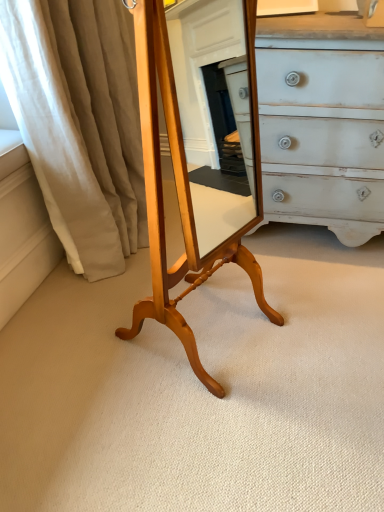
The height and width of the screenshot is (512, 384). I want to click on light brown wood table at center, so click(177, 196).

This screenshot has width=384, height=512. What do you see at coordinates (177, 196) in the screenshot? I see `light brown wood table at center` at bounding box center [177, 196].

Where is `beige fabric curtain at left`? The image size is (384, 512). beige fabric curtain at left is located at coordinates (80, 123).

Measure the distance between beige fabric curtain at left and camera.

beige fabric curtain at left and camera are 3.66 feet apart from each other.

The height and width of the screenshot is (512, 384). Describe the element at coordinates (80, 123) in the screenshot. I see `beige fabric curtain at left` at that location.

Image resolution: width=384 pixels, height=512 pixels. I want to click on light brown wood table at center, so click(177, 196).

Considering the positions of objects beige fabric curtain at left and light brown wood table at center in the image provided, who is more to the left, beige fabric curtain at left or light brown wood table at center?

Positioned to the left is beige fabric curtain at left.

Looking at this image, considering the positions of objects beige fabric curtain at left and light brown wood table at center in the image provided, who is behind, beige fabric curtain at left or light brown wood table at center?

beige fabric curtain at left is further from the camera.

Is point (25, 140) closer to camera compared to point (155, 20)?

That is False.

From the image's perspective, would you say beige fabric curtain at left is shown under light brown wood table at center?

No.

From a real-world perspective, is beige fabric curtain at left positioned above or below light brown wood table at center?

beige fabric curtain at left is situated lower than light brown wood table at center in the real world.

Considering the sizes of objects beige fabric curtain at left and light brown wood table at center in the image provided, who is wider, beige fabric curtain at left or light brown wood table at center?

Wider between the two is beige fabric curtain at left.

Looking at this image, between beige fabric curtain at left and light brown wood table at center, which one has more height?

Standing taller between the two is light brown wood table at center.

Between beige fabric curtain at left and light brown wood table at center, which one has larger size?

beige fabric curtain at left is bigger.

Is beige fabric curtain at left inside or outside of light brown wood table at center?

beige fabric curtain at left cannot be found inside light brown wood table at center.

Is beige fabric curtain at left with light brown wood table at center?

No, beige fabric curtain at left is not beside light brown wood table at center.

Does beige fabric curtain at left turn towards light brown wood table at center?

No, beige fabric curtain at left is not aimed at light brown wood table at center.

What's the angular difference between beige fabric curtain at left and light brown wood table at center's facing directions?

64.4 degrees separate the facing orientations of beige fabric curtain at left and light brown wood table at center.

Consider the image. Measure the distance between beige fabric curtain at left and light brown wood table at center.

They are 20.81 inches apart.

Find the location of a particular element. This screenshot has width=384, height=512. table on the right of beige fabric curtain at left is located at coordinates (177, 196).

Is light brown wood table at center to the left of beige fabric curtain at left from the viewer's perspective?

Incorrect, light brown wood table at center is not on the left side of beige fabric curtain at left.

Considering the relative positions of light brown wood table at center and beige fabric curtain at left in the image provided, is light brown wood table at center behind beige fabric curtain at left?

No, the depth of light brown wood table at center is less than that of beige fabric curtain at left.

Does point (209, 377) come in front of point (128, 106)?

That is True.

From the image's perspective, is light brown wood table at center below beige fabric curtain at left?

Correct, light brown wood table at center appears lower than beige fabric curtain at left in the image.

From a real-world perspective, who is located lower, light brown wood table at center or beige fabric curtain at left?

From a 3D spatial view, beige fabric curtain at left is below.

Considering the sizes of light brown wood table at center and beige fabric curtain at left in the image, is light brown wood table at center wider or thinner than beige fabric curtain at left?

Clearly, light brown wood table at center has less width compared to beige fabric curtain at left.

Who is shorter, light brown wood table at center or beige fabric curtain at left?

beige fabric curtain at left is shorter.

Based on their sizes in the image, would you say light brown wood table at center is bigger or smaller than beige fabric curtain at left?

Considering their sizes, light brown wood table at center takes up less space than beige fabric curtain at left.

Choose the correct answer: Is light brown wood table at center inside beige fabric curtain at left or outside it?

light brown wood table at center lies outside beige fabric curtain at left.

Would you consider light brown wood table at center to be distant from beige fabric curtain at left?

No.

Is light brown wood table at center turned away from beige fabric curtain at left?

Correct, light brown wood table at center is looking away from beige fabric curtain at left.

The image size is (384, 512). Find the location of `table on the right of beige fabric curtain at left`. table on the right of beige fabric curtain at left is located at coordinates (177, 196).

Locate an element on the screen. The width and height of the screenshot is (384, 512). table below the beige fabric curtain at left (from the image's perspective) is located at coordinates (177, 196).

At what (x,y) coordinates should I click in order to perform the action: click on table on the right of the beige fabric curtain at left. Please return your answer as a coordinate pair (x, y). Looking at the image, I should click on (177, 196).